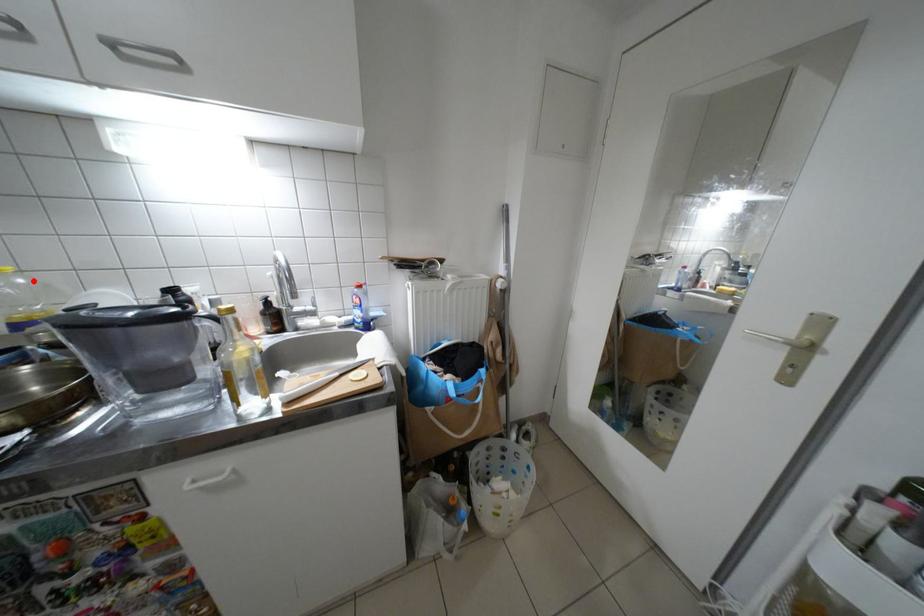
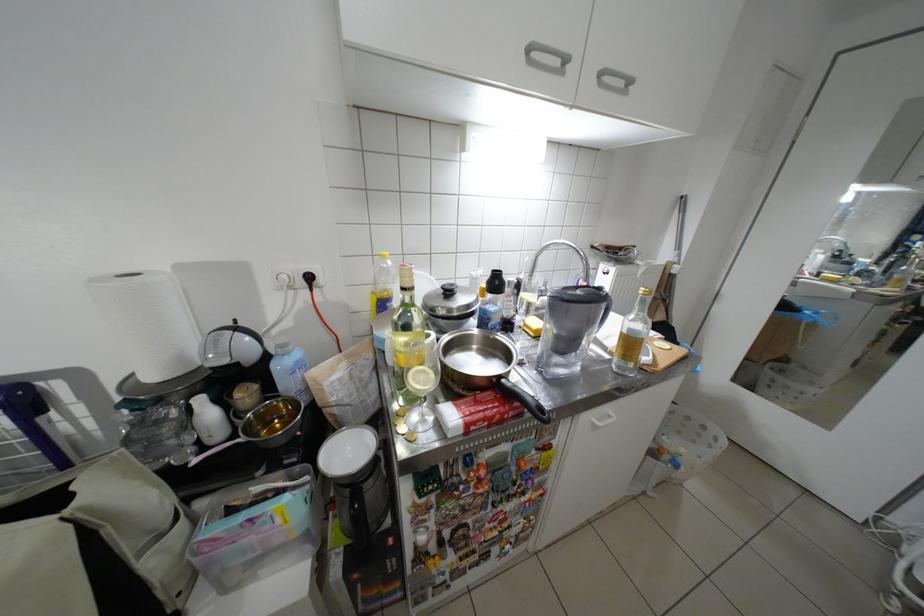
Find the pixel in the second image that matches the highlighted location in the first image.

(400, 264)